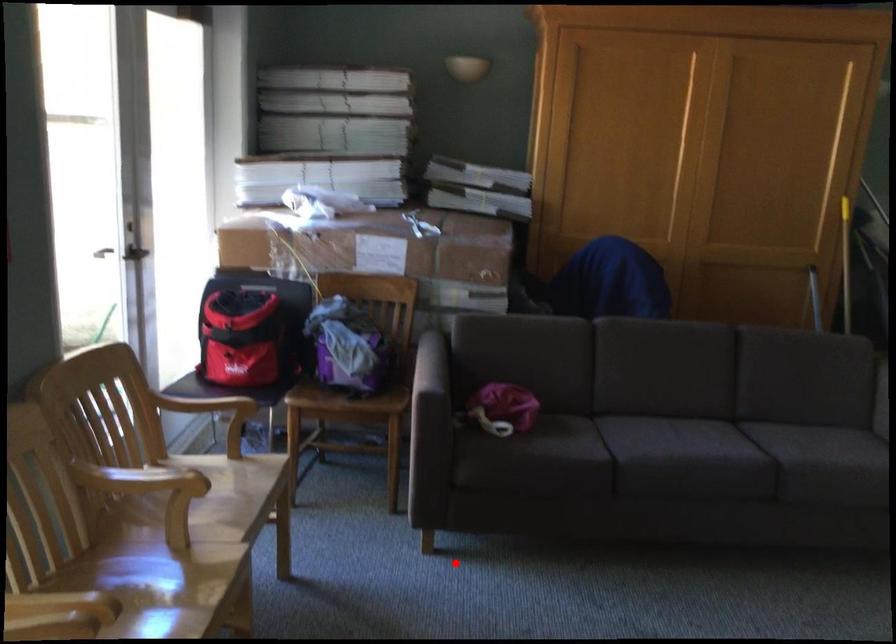
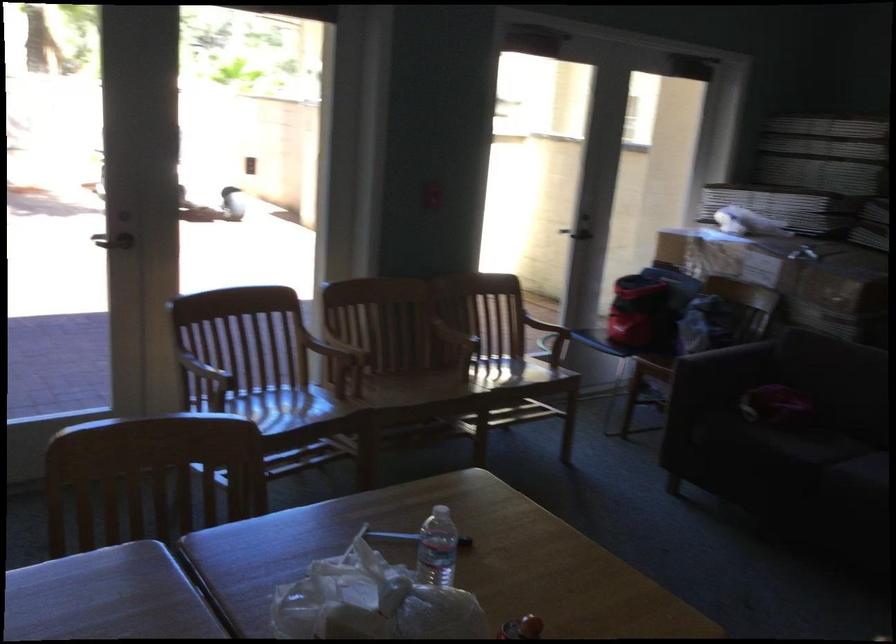
Find the pixel in the second image that matches the highlighted location in the first image.

(673, 488)